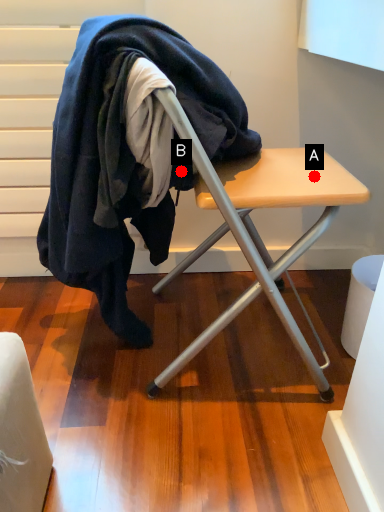
Question: Two points are circled on the image, labeled by A and B beside each circle. Which of the following is the farthest from the observer?

Choices:
 (A) A is further
 (B) B is further

Answer: (A)